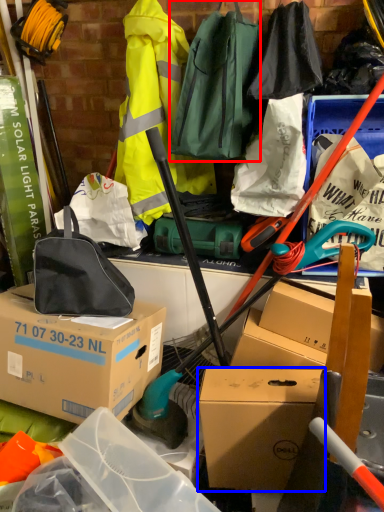
Question: Which of the following is the closest to the observer, luggage and bags (highlighted by a red box) or box (highlighted by a blue box)?

Choices:
 (A) luggage and bags
 (B) box

Answer: (A)